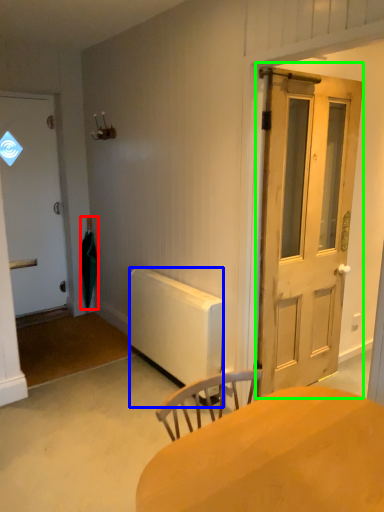
Question: Considering the real-world distances, which object is closest to umbrella (highlighted by a red box)? radiator (highlighted by a blue box) or door (highlighted by a green box).

Choices:
 (A) radiator
 (B) door

Answer: (A)